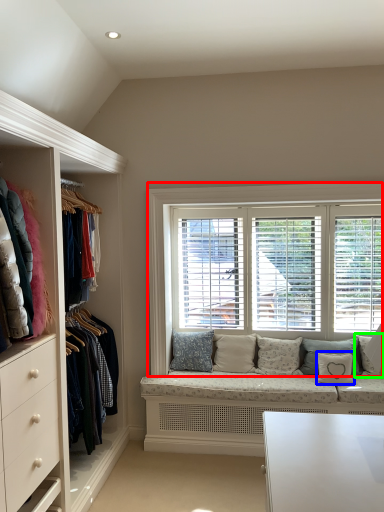
Question: Considering the real-world distances, which object is farthest from window (highlighted by a red box)? pillow (highlighted by a blue box) or pillow (highlighted by a green box)?

Choices:
 (A) pillow
 (B) pillow

Answer: (B)